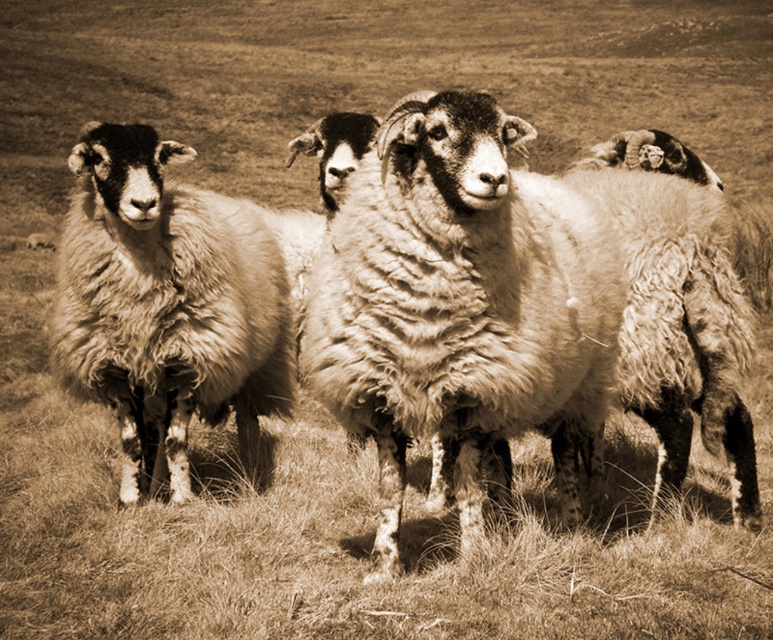
Who is shorter, fuzzy woolly sheep at center or fuzzy woolly sheep at left?

fuzzy woolly sheep at center

Does fuzzy woolly sheep at center come behind fuzzy woolly sheep at left?

No, it is not.

The height and width of the screenshot is (640, 773). What do you see at coordinates (465, 308) in the screenshot? I see `fuzzy woolly sheep at center` at bounding box center [465, 308].

Where is `fuzzy woolly sheep at center`? Image resolution: width=773 pixels, height=640 pixels. fuzzy woolly sheep at center is located at coordinates (465, 308).